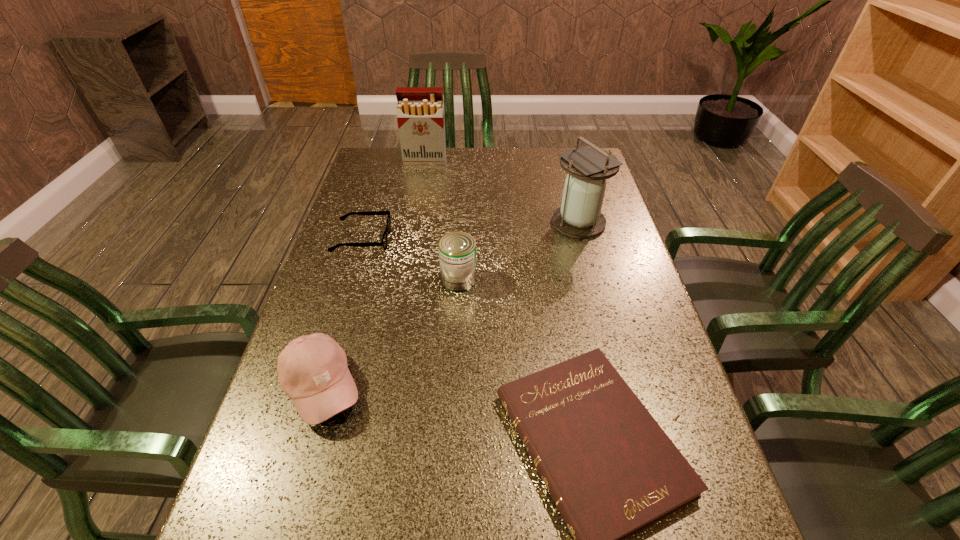
In the image, there is a desktop. Where is `free region at the far left corner`? This screenshot has height=540, width=960. free region at the far left corner is located at coordinates (360, 177).

Where is `vacant area that lies between the baseball cap and the lantern`? vacant area that lies between the baseball cap and the lantern is located at coordinates (450, 305).

Locate an element on the screen. Image resolution: width=960 pixels, height=540 pixels. free spot between the third nearest object and the farthest object is located at coordinates (442, 219).

Find the location of a particular element. Image resolution: width=960 pixels, height=540 pixels. free point between the fourth farthest object and the farthest object is located at coordinates pos(442,219).

Where is `empty space between the baseball cap and the lantern`? empty space between the baseball cap and the lantern is located at coordinates (450, 305).

The image size is (960, 540). What are the coordinates of `free spot between the cigarette case and the second shortest object` in the screenshot? It's located at (394, 199).

This screenshot has height=540, width=960. I want to click on vacant space that is in between the baseball cap and the can, so click(x=390, y=333).

This screenshot has width=960, height=540. I want to click on free space between the lantern and the baseball cap, so click(x=450, y=305).

The width and height of the screenshot is (960, 540). What are the coordinates of `free space between the can and the lantern` in the screenshot? It's located at (518, 251).

Where is `empty space between the baseball cap and the spectacles`? The image size is (960, 540). empty space between the baseball cap and the spectacles is located at coordinates (342, 314).